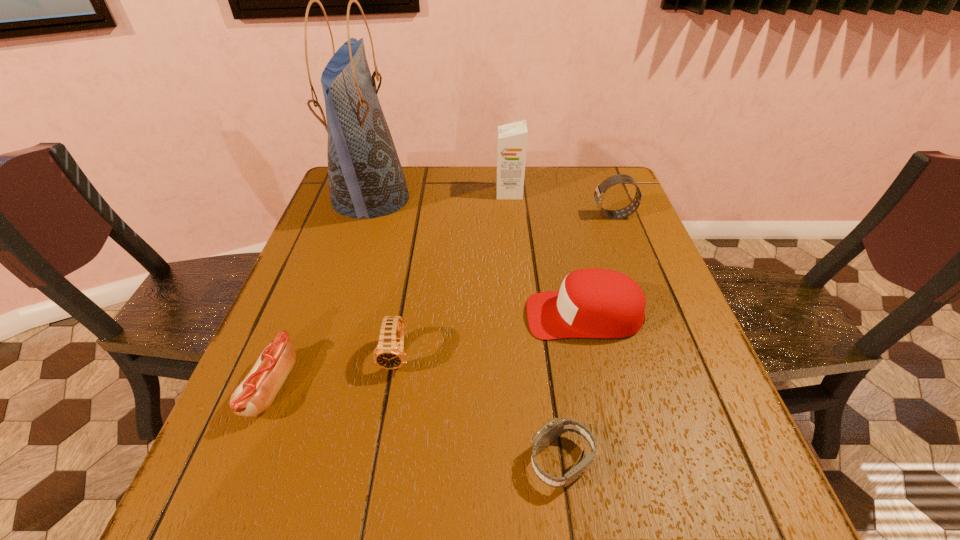
Identify the location of free spot located on the front of the shopping bag. (347, 272).

Locate an element on the screen. blank space located 0.210m on the front of the carton is located at coordinates (514, 245).

Find the location of a particular element. blank area located 0.100m on the face of the tallest watch is located at coordinates (557, 215).

Where is `free spot located on the face of the tallest watch`? Image resolution: width=960 pixels, height=540 pixels. free spot located on the face of the tallest watch is located at coordinates (503, 215).

This screenshot has width=960, height=540. In order to click on free space located on the face of the tallest watch in this screenshot , I will do `click(452, 215)`.

The image size is (960, 540). Find the location of `free space located 0.060m on the front-facing side of the baseball cap`. free space located 0.060m on the front-facing side of the baseball cap is located at coordinates (498, 315).

This screenshot has width=960, height=540. I want to click on vacant region located on the front-facing side of the baseball cap, so (416, 315).

At what (x,y) coordinates should I click in order to perform the action: click on free space located 0.140m on the front-facing side of the baseball cap. Please return your answer as a coordinate pair (x, y). The height and width of the screenshot is (540, 960). Looking at the image, I should click on (462, 315).

Where is `blank area located 0.230m on the face of the second shortest watch`? The height and width of the screenshot is (540, 960). blank area located 0.230m on the face of the second shortest watch is located at coordinates (372, 503).

The image size is (960, 540). Identify the location of vacant space located on the face of the nearest object. (347, 461).